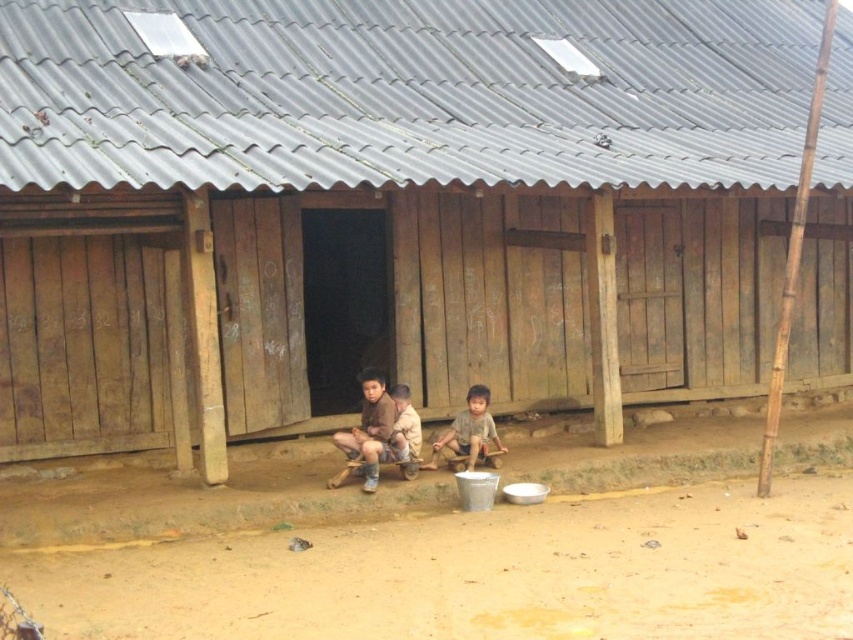
Between point (383, 451) and point (474, 433), which one is positioned in front?

Positioned in front is point (383, 451).

Who is taller, brown leather shoes at center or light brown wooden child at center?

With more height is brown leather shoes at center.

This screenshot has height=640, width=853. Find the location of `brown leather shoes at center`. brown leather shoes at center is located at coordinates (393, 440).

Identify the location of brown leather shoes at center. (393, 440).

Who is higher up, brown wooden boy at center or brown leather shoes at center?

brown wooden boy at center is above.

How far apart are brown wooden boy at center and brown leather shoes at center?

brown wooden boy at center and brown leather shoes at center are 3.40 inches apart from each other.

Which is behind, point (380, 442) or point (361, 445)?

Positioned behind is point (380, 442).

Locate an element on the screen. Image resolution: width=853 pixels, height=640 pixels. brown wooden boy at center is located at coordinates (370, 428).

Does brown sandy dirt at lower center appear over brown wooden boy at center?

No, brown sandy dirt at lower center is not above brown wooden boy at center.

Does point (264, 541) come closer to viewer compared to point (370, 452)?

Yes, point (264, 541) is in front of point (370, 452).

You are a GUI agent. You are given a task and a screenshot of the screen. Output one action in this format:
    pyautogui.click(x=<x>, y=<y>)
    Task: Click on the brown sandy dirt at lower center
    The width and height of the screenshot is (853, 640).
    Given the screenshot: What is the action you would take?
    pyautogui.click(x=480, y=573)